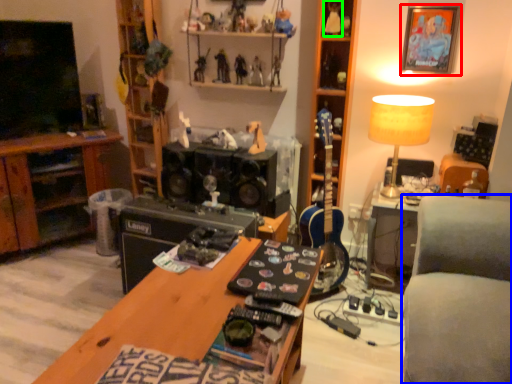
Question: Which object is positioned closest to picture frame (highlighted by a red box)? Select from studio couch (highlighted by a blue box) and toy (highlighted by a green box).

Choices:
 (A) studio couch
 (B) toy

Answer: (B)